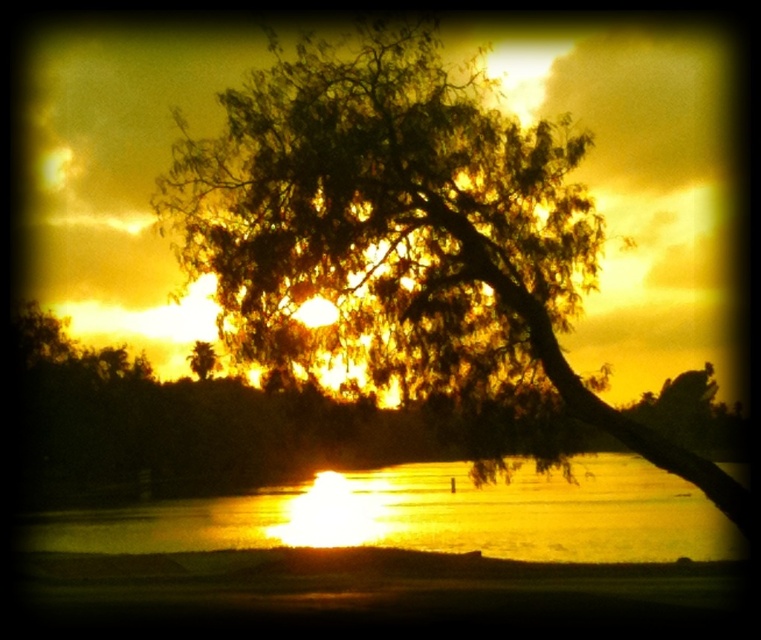
Question: Which point appears farthest from the camera in this image?

Choices:
 (A) (527, 531)
 (B) (443, 122)

Answer: (A)

Question: Is green leafy tree at center below glistening water at center?

Choices:
 (A) yes
 (B) no

Answer: (B)

Question: Is green leafy tree at center in front of glistening water at center?

Choices:
 (A) yes
 (B) no

Answer: (B)

Question: Can you confirm if green leafy tree at center is positioned above glistening water at center?

Choices:
 (A) no
 (B) yes

Answer: (B)